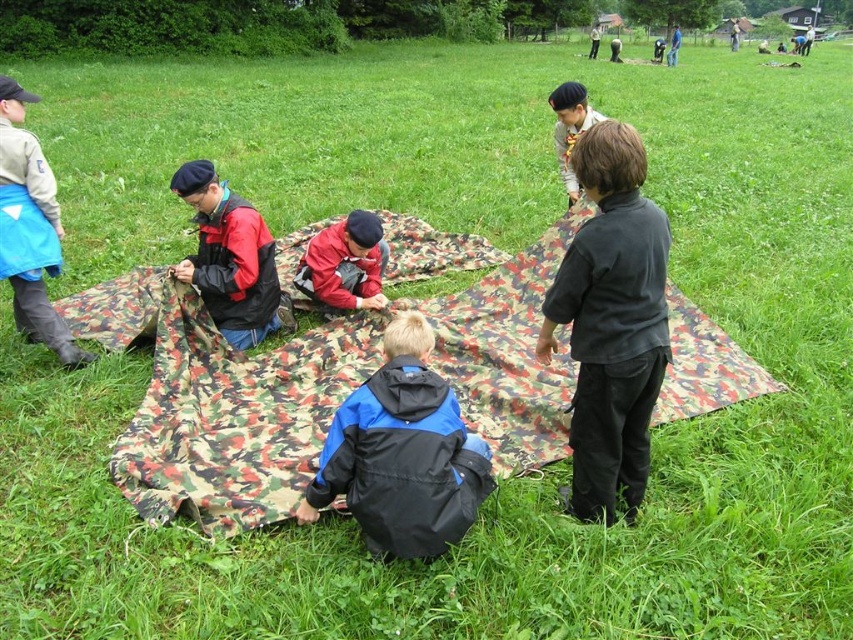
You are a GUI agent. You are given a task and a screenshot of the screen. Output one action in this format:
    pyautogui.click(x=<x>, y=<y>)
    Task: Click on the blue/black jacket at center
    The width and height of the screenshot is (853, 640).
    Given the screenshot: What is the action you would take?
    pyautogui.click(x=402, y=452)

Between point (299, 515) and point (257, 228), which one is positioned behind?

Point (257, 228)

Where is `blue/black jacket at center`? The image size is (853, 640). blue/black jacket at center is located at coordinates (402, 452).

Does camouflage fabric blanket at center have a larger size compared to dark gray shirt at center?

Yes.

Does camouflage fabric blanket at center appear under dark gray shirt at center?

Indeed, camouflage fabric blanket at center is positioned under dark gray shirt at center.

Who is more distant from viewer, (140, 490) or (653, 284)?

The point (140, 490) is behind.

Identify the location of camouflage fabric blanket at center. (219, 403).

Which is in front, point (677, 387) or point (39, 316)?

Point (677, 387) is more forward.

This screenshot has width=853, height=640. Describe the element at coordinates (219, 403) in the screenshot. I see `camouflage fabric blanket at center` at that location.

Find the location of `camouflage fabric blanket at center`. camouflage fabric blanket at center is located at coordinates (219, 403).